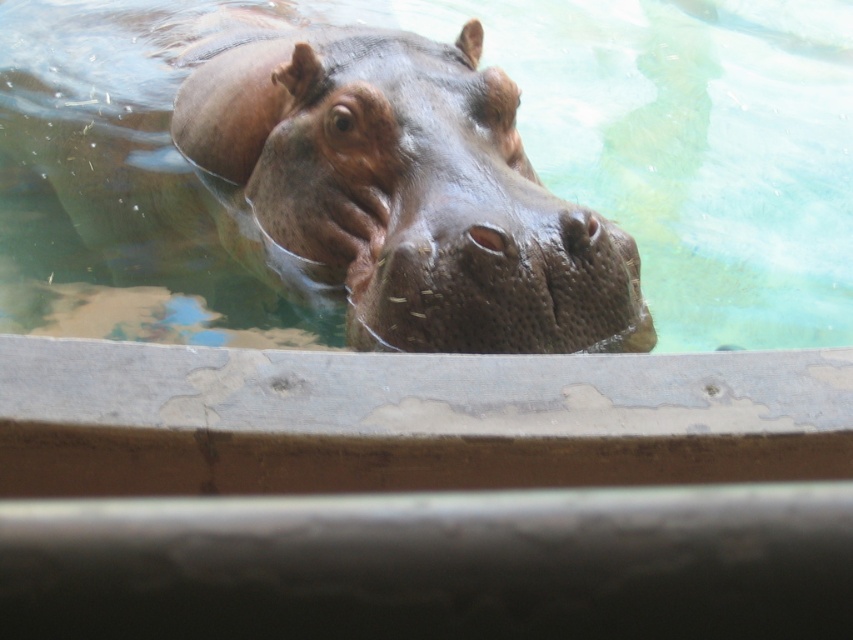
You are standing at the wooden barrier in the foreground of the hippo enclosure. You notice a point marked at coordinates (440, 172). What object does this point correspond to in the scene?

The point at coordinates (440, 172) corresponds to the smooth concrete pool at center.

You are a zookeeper observing the hippopotamus enclosure. You notice the smooth concrete pool at center and the sandy brown textured nose at center. Which object is located to the right side of the hippo?

The smooth concrete pool at center is to the right of the sandy brown textured nose at center, so the smooth concrete pool at center is located to the right side of the hippo.